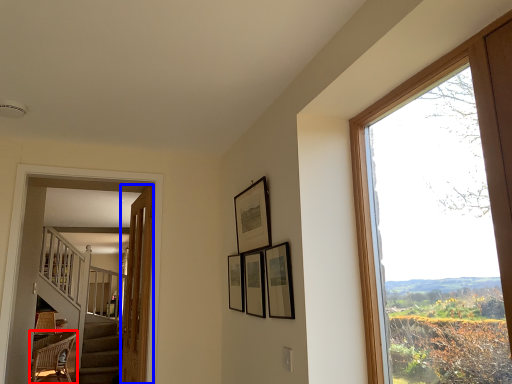
Question: Which object appears farthest to the camera in this image, chair (highlighted by a red box) or door (highlighted by a blue box)?

Choices:
 (A) chair
 (B) door

Answer: (A)